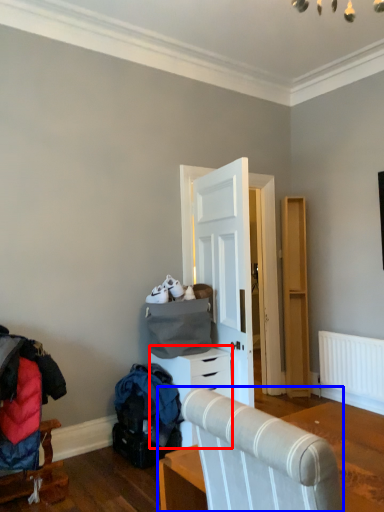
Question: Among these objects, which one is farthest to the camera, chest of drawers (highlighted by a red box) or furniture (highlighted by a blue box)?

Choices:
 (A) chest of drawers
 (B) furniture

Answer: (A)